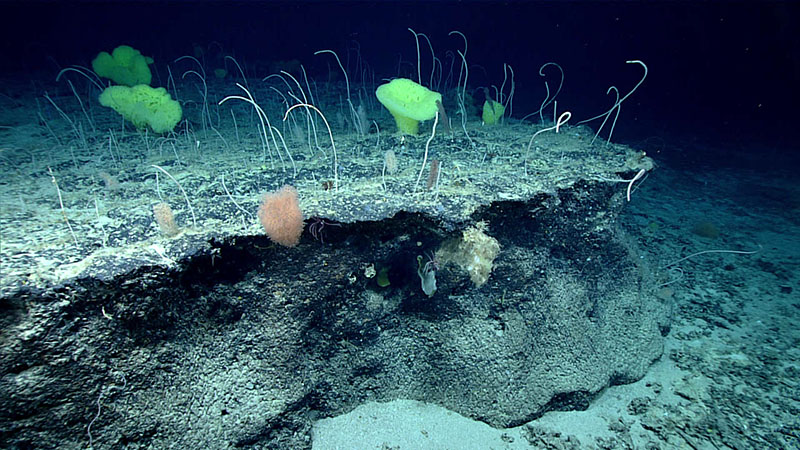
Find the location of a particular element. This screenshot has width=800, height=450. white sponge is located at coordinates 170,216, 393,162, 434,176, 108,180.